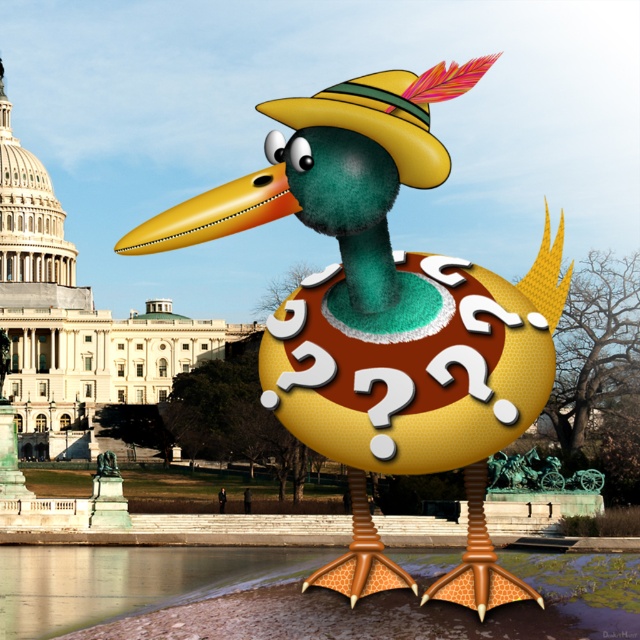
Question: Does matte yellow duck at center appear under brushed metal statue at center?

Choices:
 (A) yes
 (B) no

Answer: (B)

Question: Which point appears farthest from the camera in this image?

Choices:
 (A) (346, 212)
 (B) (8, 356)

Answer: (B)

Question: Is matte yellow duck at center positioned in front of brushed metal statue at center?

Choices:
 (A) no
 (B) yes

Answer: (B)

Question: Can you confirm if matte yellow duck at center is smaller than brushed metal statue at center?

Choices:
 (A) yes
 (B) no

Answer: (B)

Question: Which point is farther from the camera taking this photo?

Choices:
 (A) (480, 376)
 (B) (0, 381)

Answer: (B)